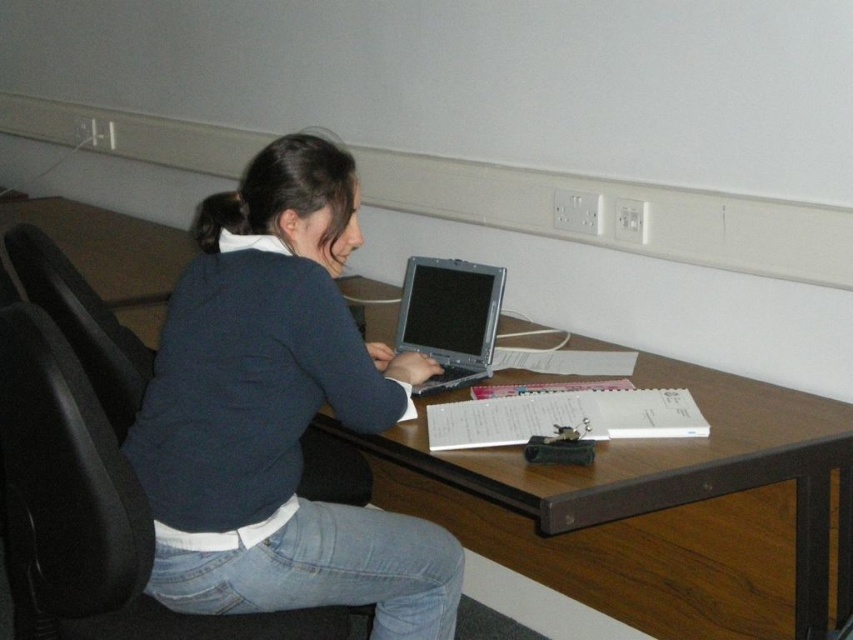
You are an office worker who needs to move a 20cm wide box from the desk to the floor. The desk has the silver metallic laptop at center and the black leather swivel chair at left. Can you place the box on the desk between these two items without touching either?

The black leather swivel chair at left is wider than the silver metallic laptop at center. Since the chair is wider, there might be enough space between them to place the 20cm box without touching either item, but it depends on the exact distance between them. However, based on the given information, we can confirm the chair is wider, so the space between them could accommodate the box.

You are trying to reach for the dark blue sweater at center while sitting in the black leather chair at left. Can you easily grab it without moving your chair?

The dark blue sweater at center is closer to the viewer than the black leather chair at left, so you can easily grab it without moving your chair.

You are a person trying to sit down in this room. You see the black leather swivel chair at left and the black leather chair at left. Which one is positioned to the right of the other?

The black leather swivel chair at left is positioned to the right of the black leather chair at left.